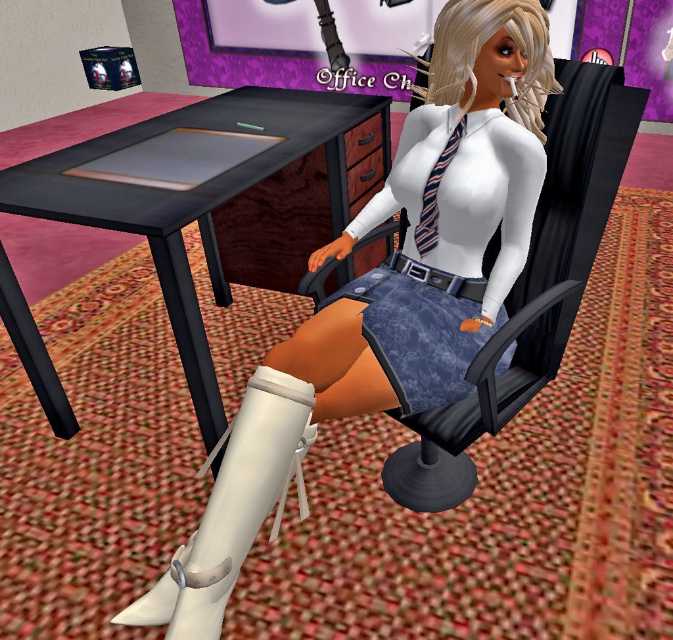
Can you confirm if white matte thigh-high boots at lower center is positioned to the left of black wood table at center?

Incorrect, white matte thigh-high boots at lower center is not on the left side of black wood table at center.

Who is shorter, white matte thigh-high boots at lower center or black wood table at center?

white matte thigh-high boots at lower center

What do you see at coordinates (386, 296) in the screenshot? I see `white matte thigh-high boots at lower center` at bounding box center [386, 296].

I want to click on white matte thigh-high boots at lower center, so click(x=386, y=296).

Is black wood table at center closer to the viewer compared to matte black swivel chair at center?

No, it is behind matte black swivel chair at center.

Who is lower down, black wood table at center or matte black swivel chair at center?

matte black swivel chair at center

Who is more distant from viewer, (205, 403) or (561, 64)?

Point (205, 403)

You are a GUI agent. You are given a task and a screenshot of the screen. Output one action in this format:
    pyautogui.click(x=<x>, y=<y>)
    Task: Click on the black wood table at center
    The image size is (673, 640).
    Given the screenshot: What is the action you would take?
    pyautogui.click(x=199, y=189)

Is white matte thigh-high boots at lower center shorter than matte black swivel chair at center?

Incorrect, white matte thigh-high boots at lower center's height does not fall short of matte black swivel chair at center's.

Between point (135, 602) and point (437, 433), which one is positioned behind?

The point (437, 433) is behind.

Is point (221, 467) positioned before point (579, 259)?

Yes, point (221, 467) is in front of point (579, 259).

Locate an element on the screen. white matte thigh-high boots at lower center is located at coordinates (386, 296).